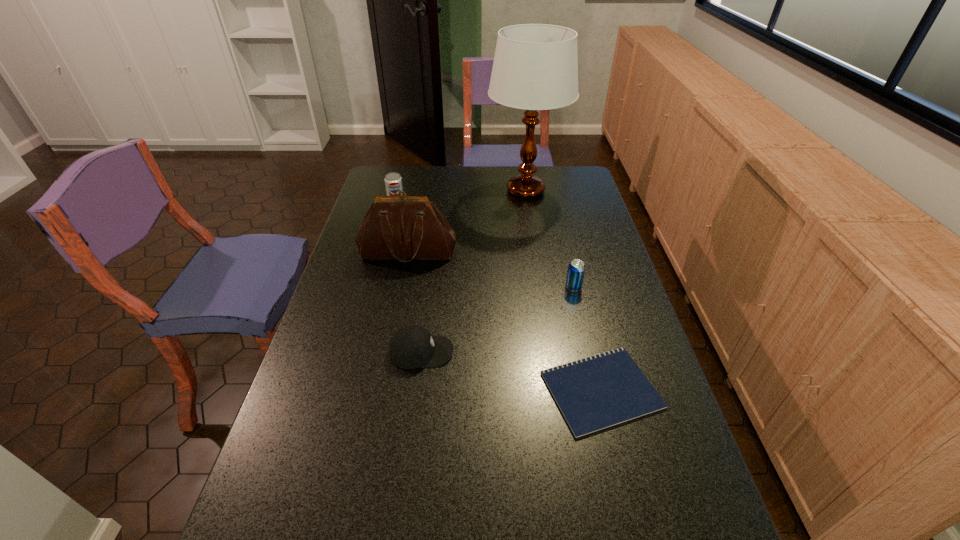
I want to click on free spot between the tallest object and the third shortest object, so click(549, 239).

What are the coordinates of `free space between the third nearest object and the tallest object` in the screenshot? It's located at (549, 239).

Locate an element on the screen. The image size is (960, 540). free space between the cap and the shoulder bag is located at coordinates pos(415,302).

Find the location of a particular element. The image size is (960, 540). empty space that is in between the table lamp and the third shortest object is located at coordinates pyautogui.click(x=549, y=239).

Image resolution: width=960 pixels, height=540 pixels. I want to click on vacant region between the table lamp and the shoulder bag, so click(467, 221).

Identify which object is the closest to the third tallest object. Please provide its 2D coordinates. Your answer should be formatted as a tuple, i.e. [(x, y)], where the tuple contains the x and y coordinates of a point satisfying the conditions above.

[(406, 228)]

You are a GUI agent. You are given a task and a screenshot of the screen. Output one action in this format:
    pyautogui.click(x=<x>, y=<y>)
    Task: Click on the fifth closest object relative to the notepad
    This screenshot has width=960, height=540.
    Given the screenshot: What is the action you would take?
    pyautogui.click(x=393, y=181)

Where is `free region that satisfies the following two spatial constraints: 1. on the front-facing side of the second shortest object; 2. on the left side of the notepad`? This screenshot has height=540, width=960. free region that satisfies the following two spatial constraints: 1. on the front-facing side of the second shortest object; 2. on the left side of the notepad is located at coordinates (416, 390).

Image resolution: width=960 pixels, height=540 pixels. Identify the location of free point that satisfies the following two spatial constraints: 1. on the front side of the soda; 2. on the left side of the beer can. (374, 287).

You are a GUI agent. You are given a task and a screenshot of the screen. Output one action in this format:
    pyautogui.click(x=<x>, y=<y>)
    Task: Click on the vacant region that satisfies the following two spatial constraints: 1. on the front side of the tallest object; 2. on the front-facing side of the second shortest object
    The height and width of the screenshot is (540, 960).
    Given the screenshot: What is the action you would take?
    pyautogui.click(x=551, y=352)